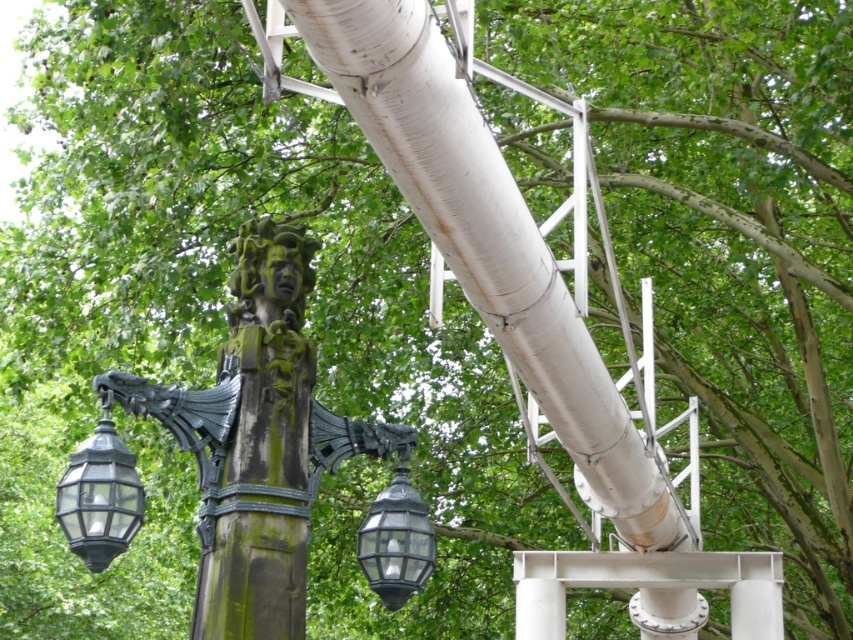
Question: Among these points, which one is nearest to the camera?

Choices:
 (A) (403, 540)
 (B) (61, 506)

Answer: (B)

Question: Which point is closer to the camera?

Choices:
 (A) (102, 419)
 (B) (410, 513)

Answer: (A)

Question: Does green mossy stone sculpture at center have a lesser width compared to matte black lantern at lower center?

Choices:
 (A) no
 (B) yes

Answer: (B)

Question: Which object is the farthest from the green mossy stone sculpture at center?

Choices:
 (A) matte black lantern at lower center
 (B) matte black lantern at lower left

Answer: (B)

Question: In this image, where is green mossy stone sculpture at center located relative to matte black lantern at lower left?

Choices:
 (A) left
 (B) right

Answer: (B)

Question: Does green mossy stone sculpture at center appear on the right side of matte black lantern at lower center?

Choices:
 (A) no
 (B) yes

Answer: (A)